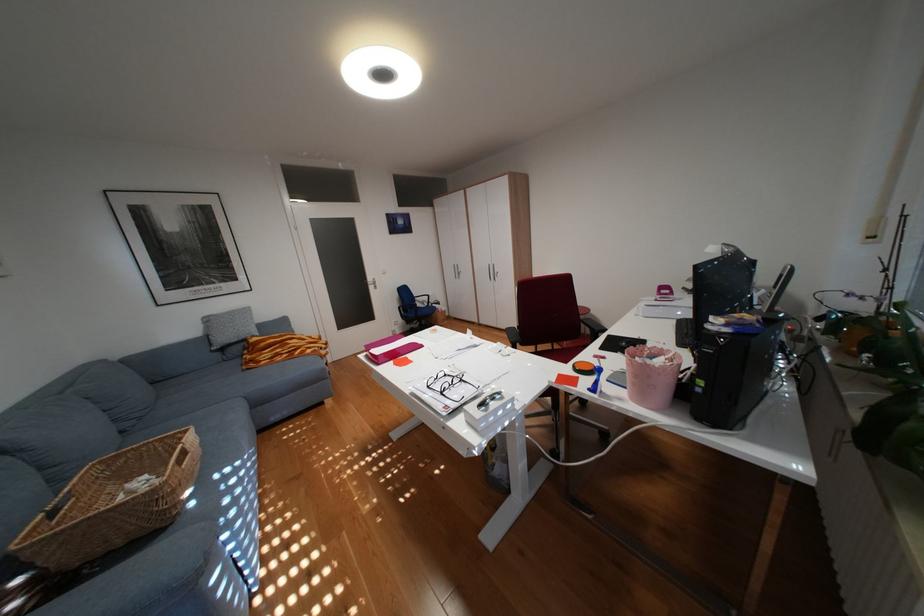
Find where to lift the pink rectangular box. Please return your answer as a coordinate pair (x, y).

(390, 349)